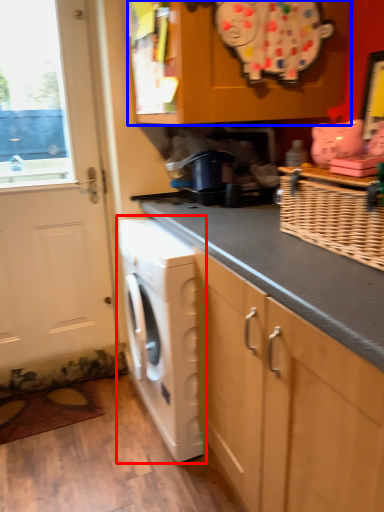
Question: Which point is further to the camera, washing machine (highlighted by a red box) or cabinetry (highlighted by a blue box)?

Choices:
 (A) washing machine
 (B) cabinetry

Answer: (A)